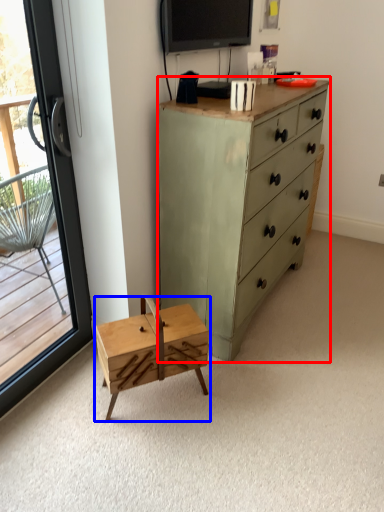
Question: Which point is further to the camera, chest of drawers (highlighted by a red box) or changing table (highlighted by a blue box)?

Choices:
 (A) chest of drawers
 (B) changing table

Answer: (B)